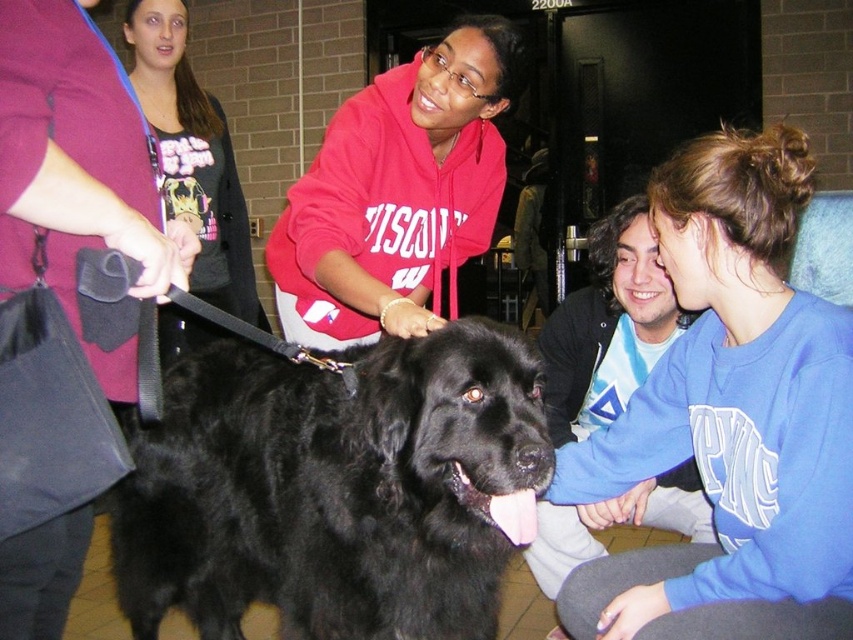
Question: Does black furry dog at center appear on the right side of matte red hoodie at center?

Choices:
 (A) yes
 (B) no

Answer: (B)

Question: Is black furry dog at center below matte black dog at center?

Choices:
 (A) no
 (B) yes

Answer: (B)

Question: Is black furry dog at center positioned in front of blue sweatshirt at lower right?

Choices:
 (A) yes
 (B) no

Answer: (A)

Question: Which point appears closest to the camera in this image?

Choices:
 (A) (418, 520)
 (B) (450, 298)

Answer: (A)

Question: Which point is farther to the camera?

Choices:
 (A) black furry dog at center
 (B) matte red hoodie at center

Answer: (B)

Question: Estimate the real-world distances between objects in this image. Which object is farther from the matte black dog at center?

Choices:
 (A) blue sweatshirt at lower right
 (B) matte black leash at left
 (C) black furry dog at center

Answer: (B)